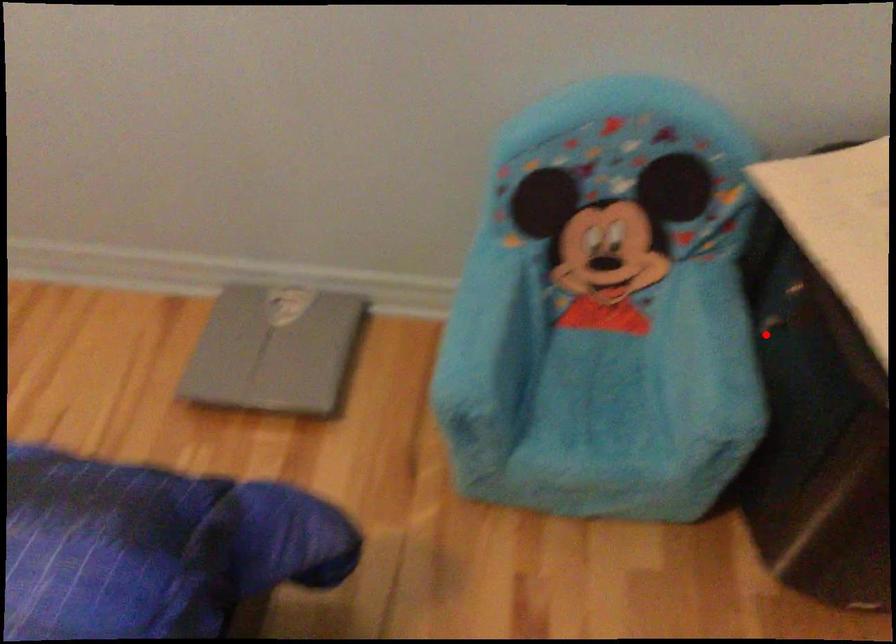
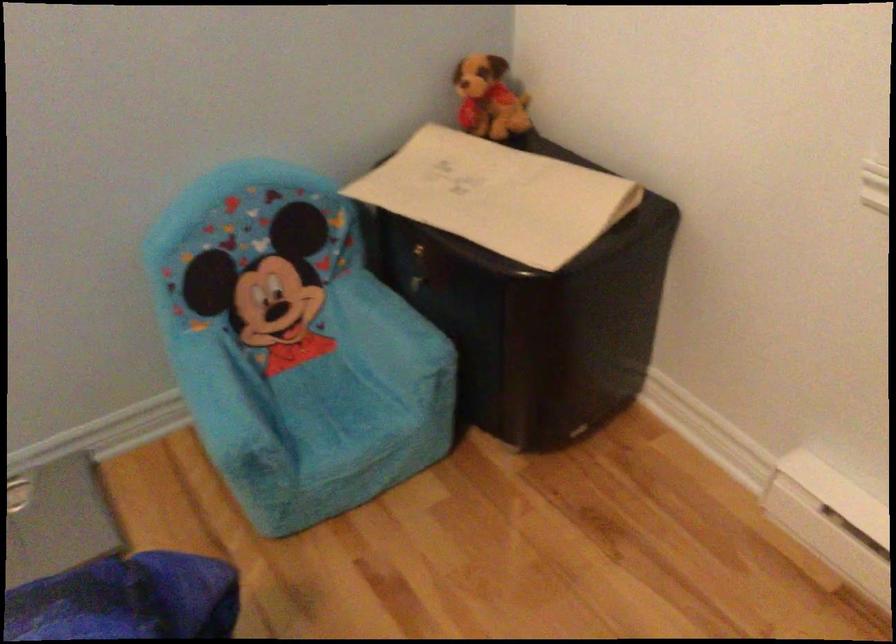
Where in the second image is the point corresponding to the highlighted location from the first image?

(419, 292)